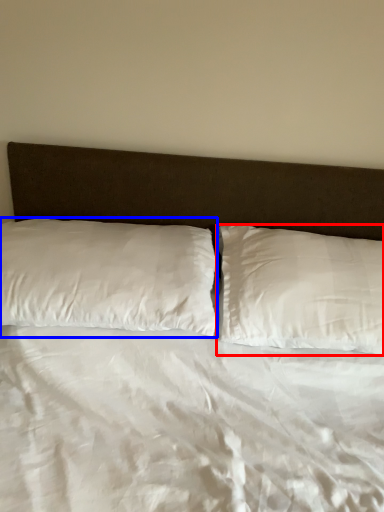
Question: Which object is further to the camera taking this photo, pillow (highlighted by a red box) or pillow (highlighted by a blue box)?

Choices:
 (A) pillow
 (B) pillow

Answer: (A)